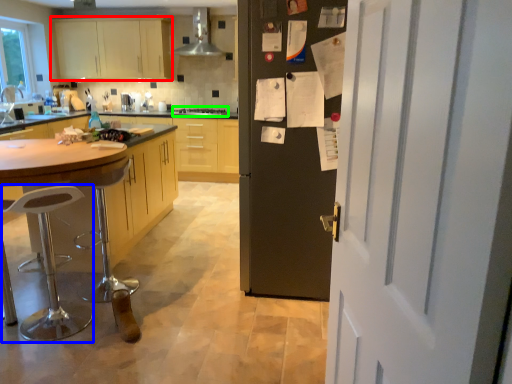
Question: Based on their relative distances, which object is nearer to cabinetry (highlighted by a red box)? Choose from bar stool (highlighted by a blue box) and stove (highlighted by a green box).

Choices:
 (A) bar stool
 (B) stove

Answer: (B)